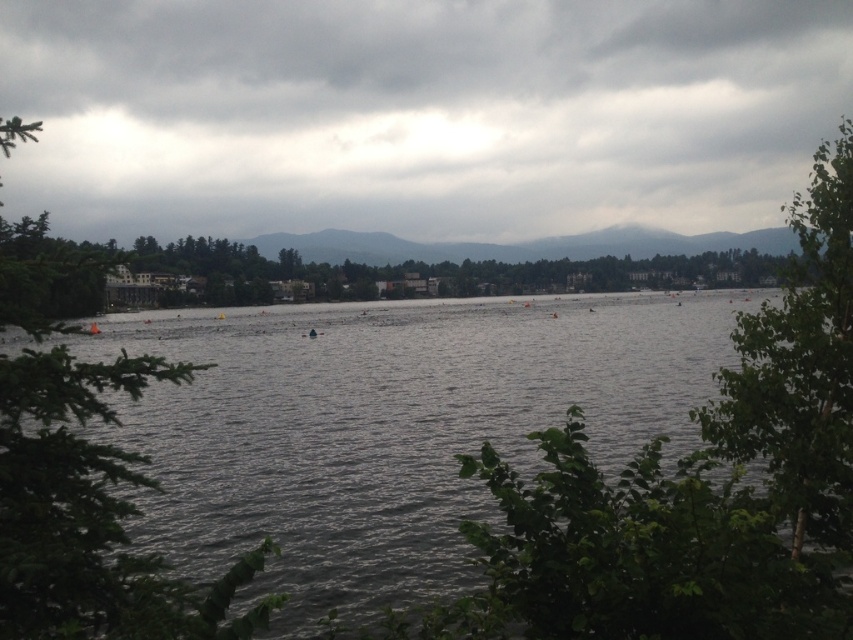
Question: Which point is closer to the camera taking this photo?

Choices:
 (A) (656, 99)
 (B) (163, 632)
 (C) (482, 429)

Answer: (B)

Question: Which point is farther to the camera?

Choices:
 (A) (38, 618)
 (B) (102, 355)

Answer: (B)

Question: Can you confirm if green leafy tree at left is smaller than green leafy tree at right?

Choices:
 (A) yes
 (B) no

Answer: (A)

Question: Is cloudy sky at upper center to the left of green leafy tree at right from the viewer's perspective?

Choices:
 (A) yes
 (B) no

Answer: (A)

Question: Estimate the real-world distances between objects in this image. Which object is farther from the dark gray water at center?

Choices:
 (A) green leafy tree at left
 (B) cloudy sky at upper center
 (C) green leafy tree at right

Answer: (B)

Question: Does green leafy tree at left have a greater width compared to green leafy tree at right?

Choices:
 (A) no
 (B) yes

Answer: (A)